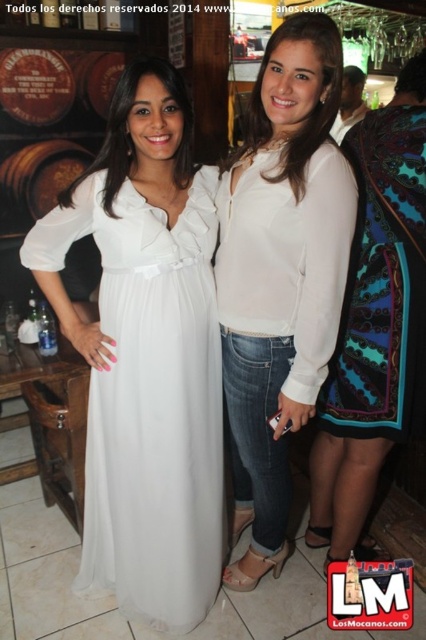
You are a photographer trying to capture the two women in the scene. You notice a white sheer dress at center located at point (149, 400). Is this dress worn by the woman on the left or the woman on the right?

The white sheer dress at center is located at point (149, 400). According to the scene description, the woman on the left is wearing a long white dress with a ruffled neckline and belt. Therefore, the white sheer dress at center is likely the dress worn by the woman on the left.

You are a photographer at a social event and need to capture a photo of both the white sheer dress at center and the patterned silk dress at right. Based on their positions, which dress is positioned lower in the frame?

The white sheer dress at center is below the patterned silk dress at right, so the white sheer dress at center is positioned lower in the frame.